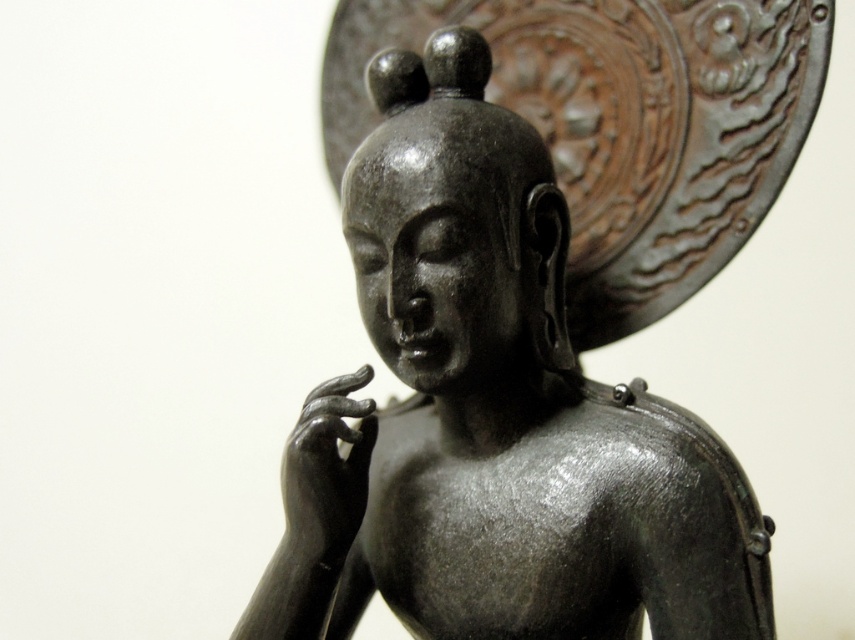
Question: Which of the following is the farthest from the observer?

Choices:
 (A) (345, 429)
 (B) (640, 397)

Answer: (B)

Question: Does matte black statue at center appear over matte black hand at center?

Choices:
 (A) yes
 (B) no

Answer: (A)

Question: Can you confirm if matte black statue at center is bigger than matte black hand at center?

Choices:
 (A) yes
 (B) no

Answer: (A)

Question: Does matte black statue at center appear under matte black hand at center?

Choices:
 (A) yes
 (B) no

Answer: (B)